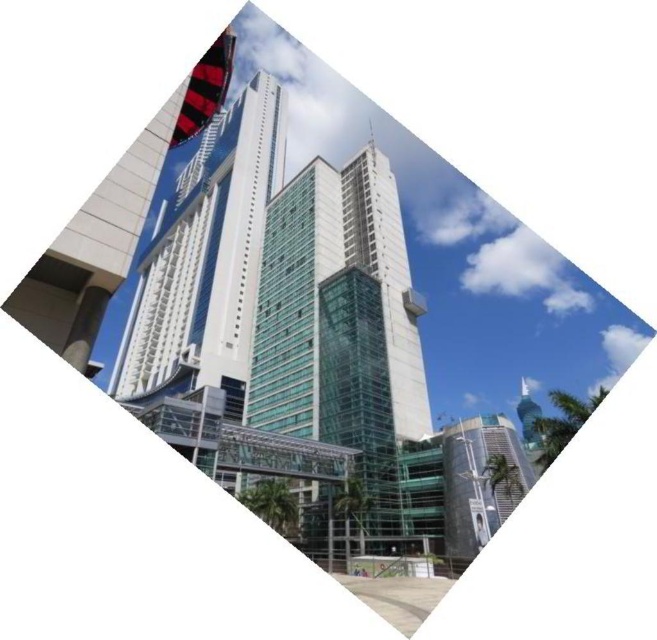
Question: Which of the following is the farthest from the observer?

Choices:
 (A) [x=196, y=280]
 (B) [x=524, y=460]

Answer: (A)

Question: Which of the following is the farthest from the observer?

Choices:
 (A) white glass building at center
 (B) glassy teal skyscraper at lower right
 (C) transparent glass tower at center

Answer: (C)

Question: Which point appears farthest from the camera in this image?

Choices:
 (A) (166, 285)
 (B) (501, 448)
 (C) (388, 230)

Answer: (A)

Question: Can you confirm if transparent glass tower at center is positioned to the left of glassy teal skyscraper at lower right?

Choices:
 (A) no
 (B) yes

Answer: (B)

Question: Does transparent glass tower at center appear under glassy teal skyscraper at lower right?

Choices:
 (A) yes
 (B) no

Answer: (B)

Question: Does transparent glass tower at center appear on the right side of white glass building at center?

Choices:
 (A) no
 (B) yes

Answer: (B)